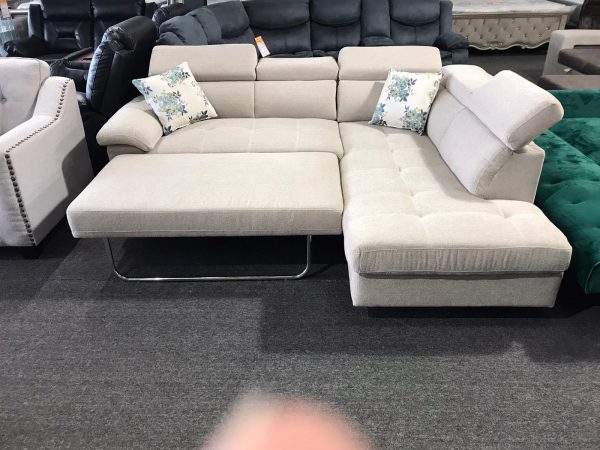
This screenshot has height=450, width=600. Find the location of `futon`. futon is located at coordinates (519, 21), (479, 33).